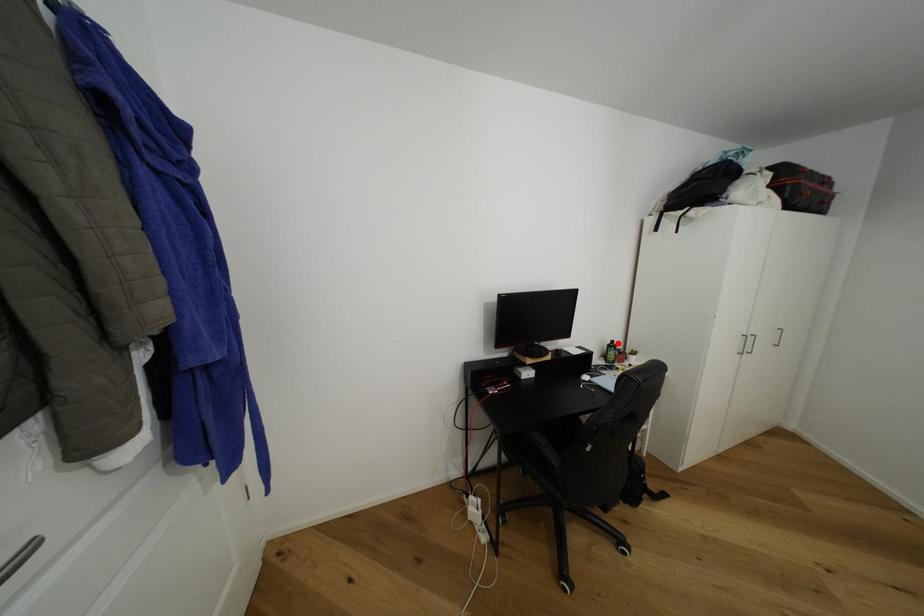
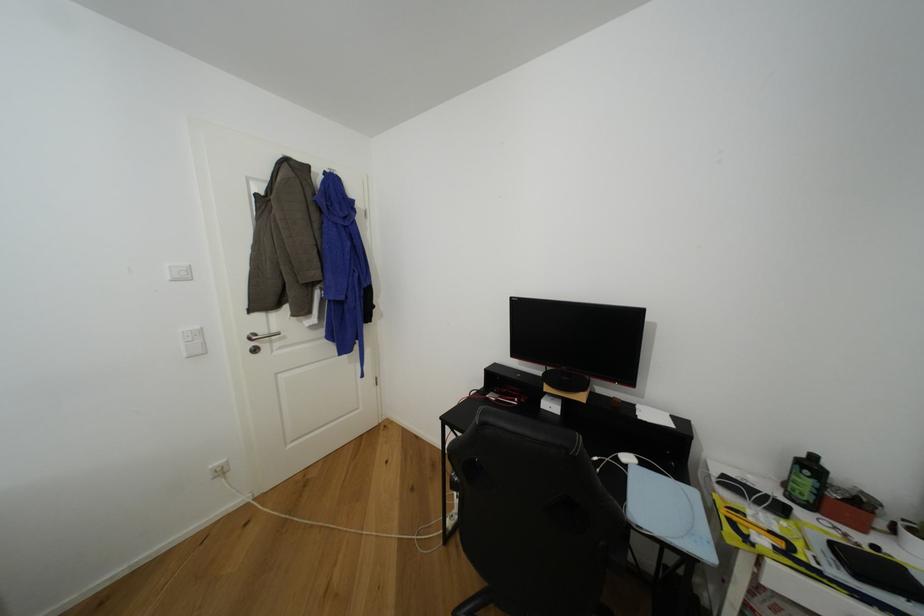
Question: A red point is marked in image1. In image2, is the corresponding 3D point closer to the camera or farther? Reply with the corresponding letter.

Choices:
 (A) The corresponding 3D point is closer.
 (B) The corresponding 3D point is farther.

Answer: (A)